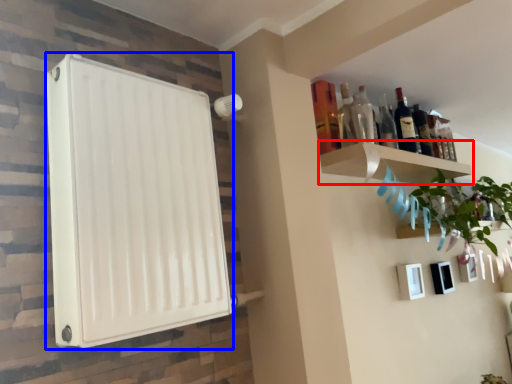
Question: Which object appears closest to the camera in this image, shelf (highlighted by a red box) or appliance (highlighted by a blue box)?

Choices:
 (A) shelf
 (B) appliance

Answer: (B)